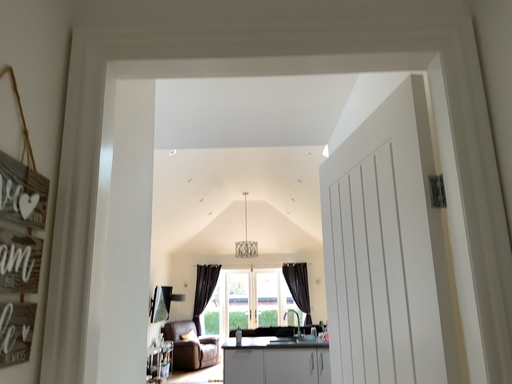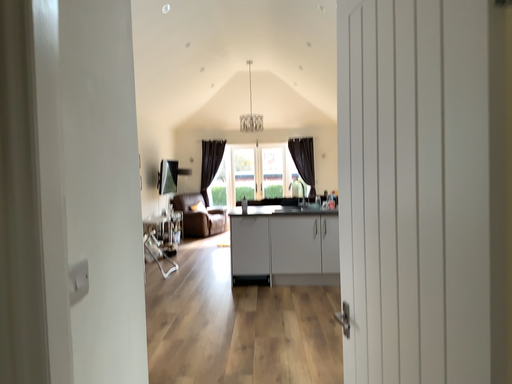
Question: Which way did the camera rotate in the video?

Choices:
 (A) rotated downward
 (B) rotated upward

Answer: (A)